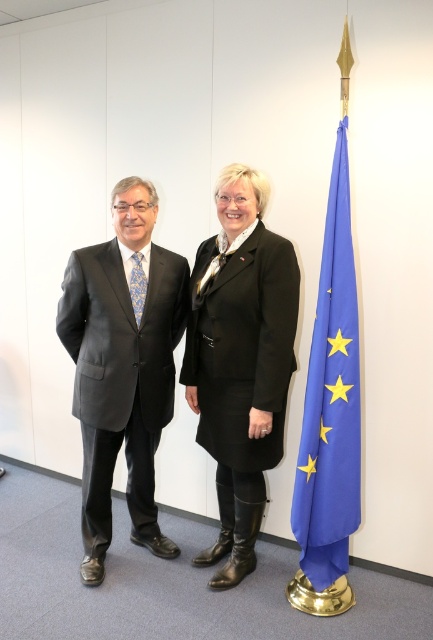
You are a photographer setting up for a group photo. You need to ensure that the matte black suit at left and the blue fabric flag at right are both visible in the frame. Based on their heights, which object should you adjust your camera angle to focus on first to ensure both are in view?

The matte black suit at left is not as tall as the blue fabric flag at right, so you should focus on the blue fabric flag at right first to ensure both are in view.

You are a photographer setting up for a group photo. You need to position a light source to the left of the matte black suit at left and to the right of the black leather coat at center. Is this possible given their positions?

The matte black suit at left is located below the black leather coat at center, so positioning a light source to the left of the matte black suit at left and to the right of the black leather coat at center is not possible because their horizontal positions overlap.